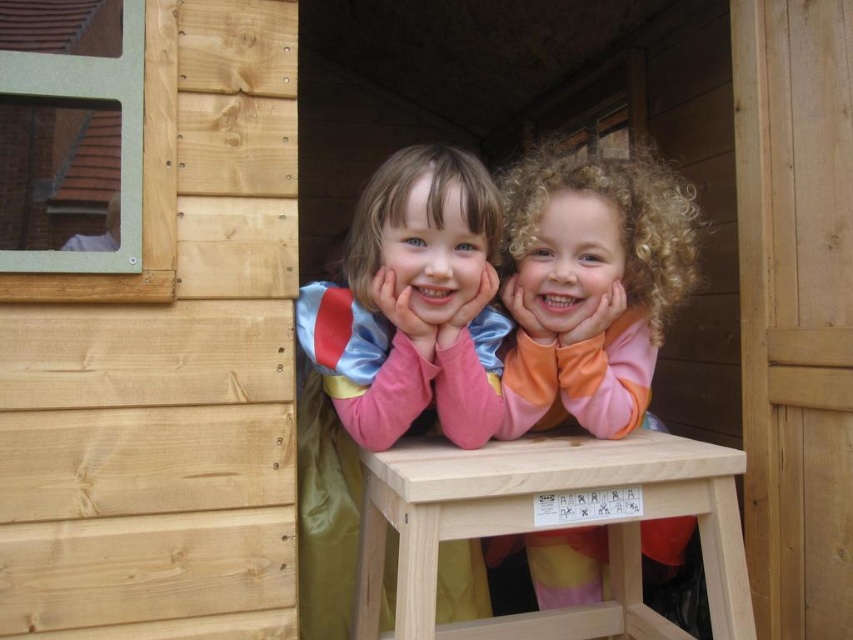
Can you confirm if matte pink sweater at center is positioned below curly-haired child at center?

Yes, matte pink sweater at center is below curly-haired child at center.

Between point (357, 428) and point (578, 595), which one is positioned behind?

The point (578, 595) is behind.

This screenshot has width=853, height=640. Describe the element at coordinates (392, 353) in the screenshot. I see `matte pink sweater at center` at that location.

I want to click on matte pink sweater at center, so click(x=392, y=353).

Can you confirm if matte pink sweater at center is thinner than light wood stool at center?

Indeed, matte pink sweater at center has a lesser width compared to light wood stool at center.

Between matte pink sweater at center and light wood stool at center, which one appears on the left side from the viewer's perspective?

matte pink sweater at center

Describe the element at coordinates (392, 353) in the screenshot. I see `matte pink sweater at center` at that location.

You are a GUI agent. You are given a task and a screenshot of the screen. Output one action in this format:
    pyautogui.click(x=<x>, y=<y>)
    Task: Click on the matte pink sweater at center
    The height and width of the screenshot is (640, 853).
    Given the screenshot: What is the action you would take?
    pyautogui.click(x=392, y=353)

Consider the image. Does curly-haired child at center lie in front of light wood stool at center?

That is False.

Locate an element on the screen. curly-haired child at center is located at coordinates (590, 285).